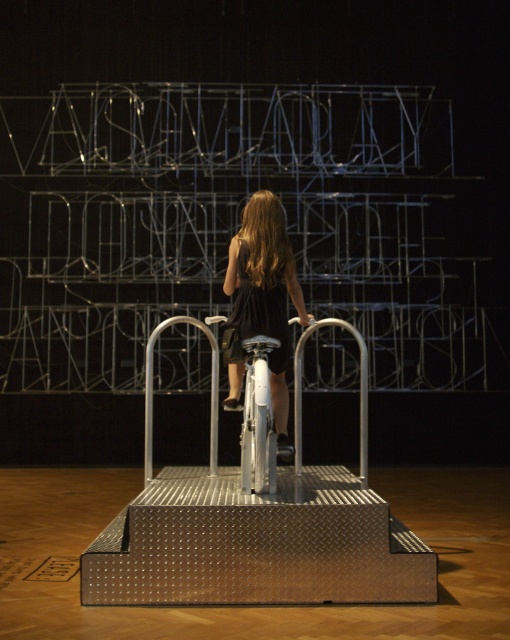
You are a fashion designer who needs to hang a black matte dress at center and a silver metallic rail at center in your studio. Given their sizes, which object requires more horizontal space to display properly?

The black matte dress at center requires more horizontal space to display properly because its width is larger than the silver metallic rail at center.

You are a photographer setting up a shoot in this room. You have a camera with a 1.2 meter wide lens. You need to position it so that both the silver metallic rail at center and the black satin dress at center are fully in frame. Can the lens accommodate both objects side by side?

The silver metallic rail at center might be wider than black satin dress at center, so the total width required to fit both side by side could exceed the 1.2 meter lens width. Therefore, it is uncertain if the lens can accommodate both objects without cropping.

You are a photographer trying to capture the stationary bike and the metal structure in the background. You notice two points marked in the scene. Which of the two points, point [273,269] or point [367,403], is closer to your camera lens?

Point [273,269] is closer to the camera than point [367,403].